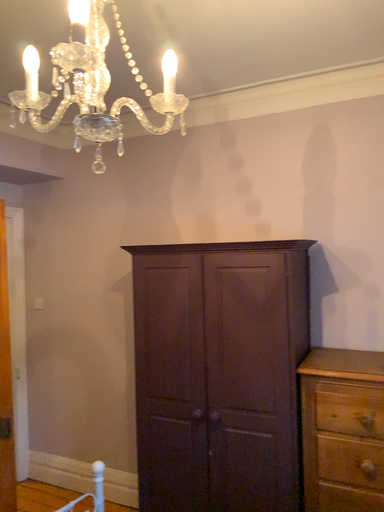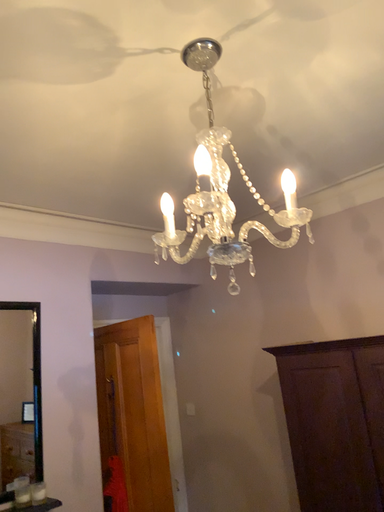
Question: Which way did the camera rotate in the video?

Choices:
 (A) rotated left
 (B) rotated right

Answer: (A)